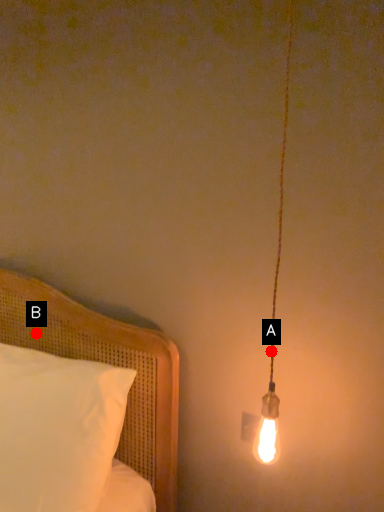
Question: Two points are circled on the image, labeled by A and B beside each circle. Which point appears closest to the camera in this image?

Choices:
 (A) A is closer
 (B) B is closer

Answer: (A)